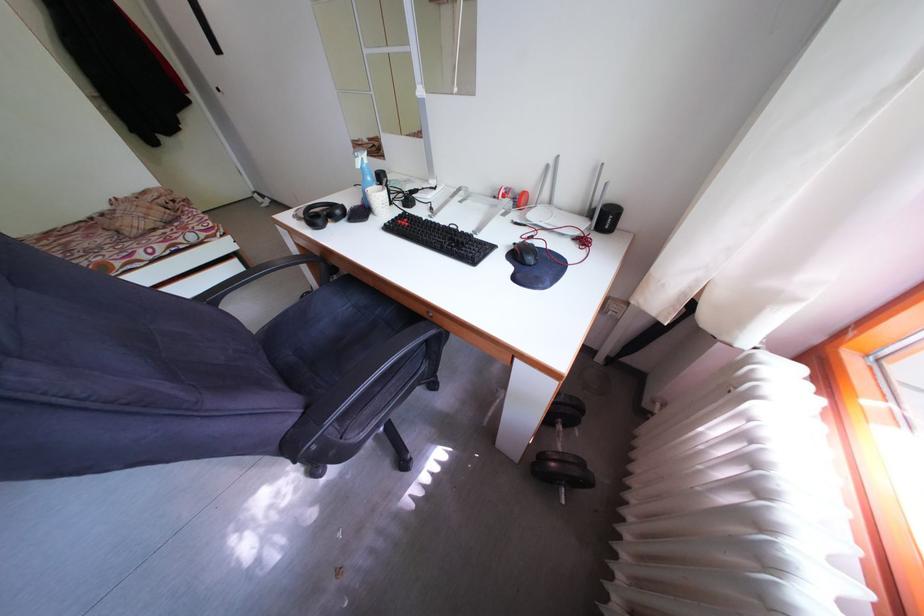
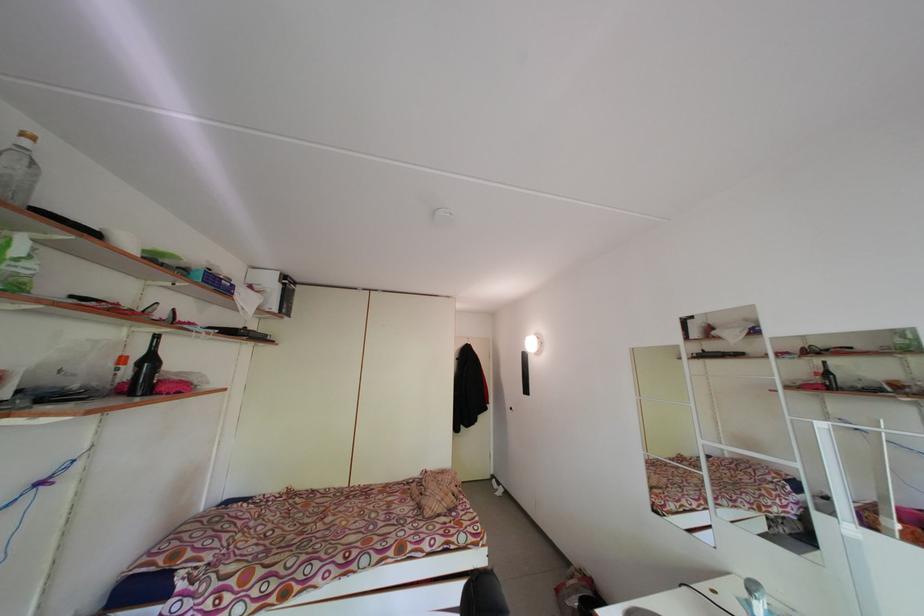
First-person continuous shooting, in which direction is the camera rotating?

The camera's rotation is toward left-up.